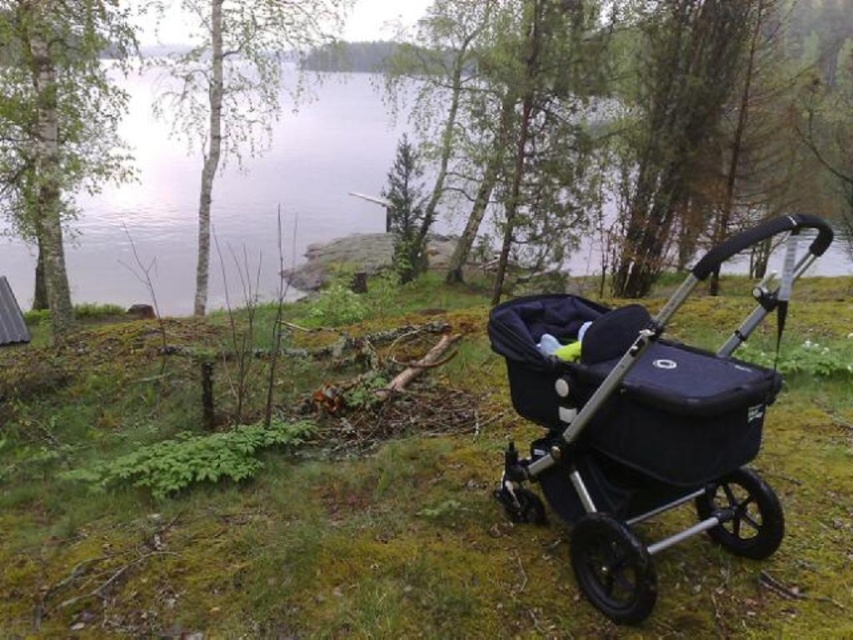
You are a parent carrying a baby and need to cross the clear water at center to reach the other side. The black fabric stroller at center is in your way. Can you move the stroller to make a path?

The black fabric stroller at center is positioned under clear water at center, so you can move the stroller to create a path through the clear water at center.

You are a parent holding a toddler and need to place them in the black fabric stroller at center or the clear water at center. Which one is more appropriate for placing the toddler?

The black fabric stroller at center is more appropriate for placing the toddler because it is designed for that purpose, while the clear water at center is a body of water and not safe for a child.